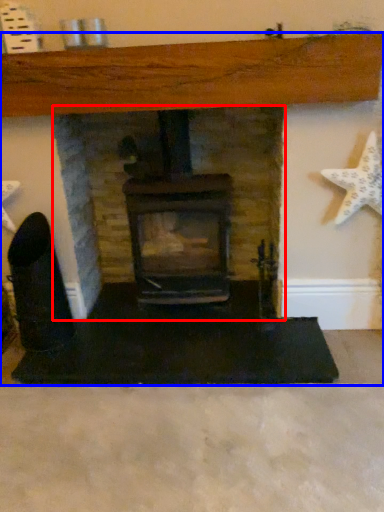
Question: Which of the following is the closest to the observer, fireplace (highlighted by a red box) or fireplace (highlighted by a blue box)?

Choices:
 (A) fireplace
 (B) fireplace

Answer: (B)